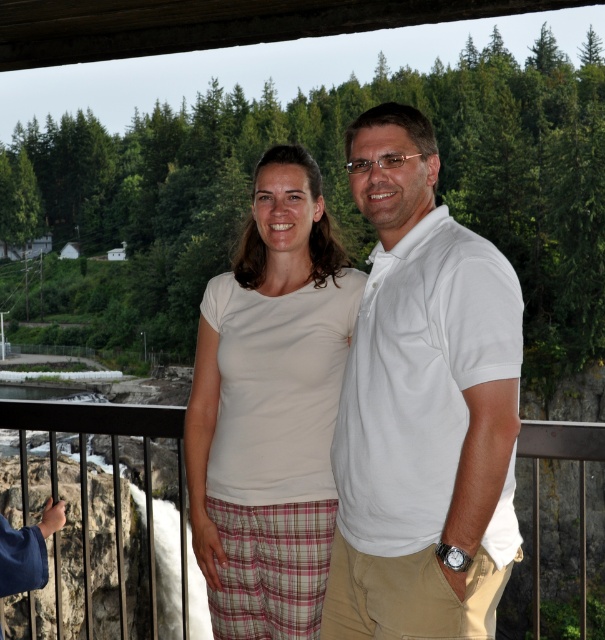
You are taking a photo of two people standing near a railing. You notice two points marked in the image. The first point is at coordinates point [396,401] and the second is at point [2,419]. Based on their positions, which point is closer to the camera?

Point [396,401] is in front of point [2,419], so it is closer to the camera.

You are a photographer trying to capture a clear shot of the white cotton shirt at center and the black metal railing at center. Based on their positions, which object is closer to the camera?

The white cotton shirt at center is closer to the camera because it is positioned above the black metal railing at center, indicating it is in a nearer plane.

You are trying to decide which white shirt to wear for a casual event. Both the white cotton polo shirt at center and the white cotton shirt at center are available. If you want a slimmer fit, which one should you choose?

The white cotton polo shirt at center has a lesser width compared to the white cotton shirt at center, so it would provide a slimmer fit.